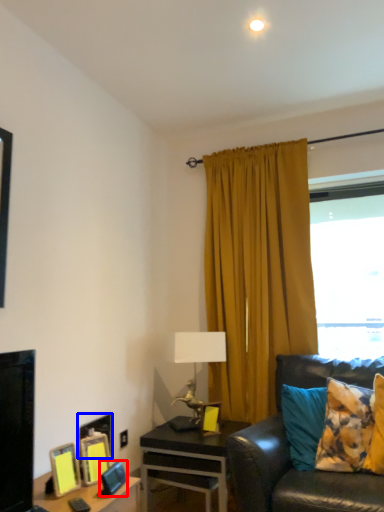
Question: Which point is closer to the camera, picture frame (highlighted by a red box) or picture frame (highlighted by a blue box)?

Choices:
 (A) picture frame
 (B) picture frame

Answer: (A)